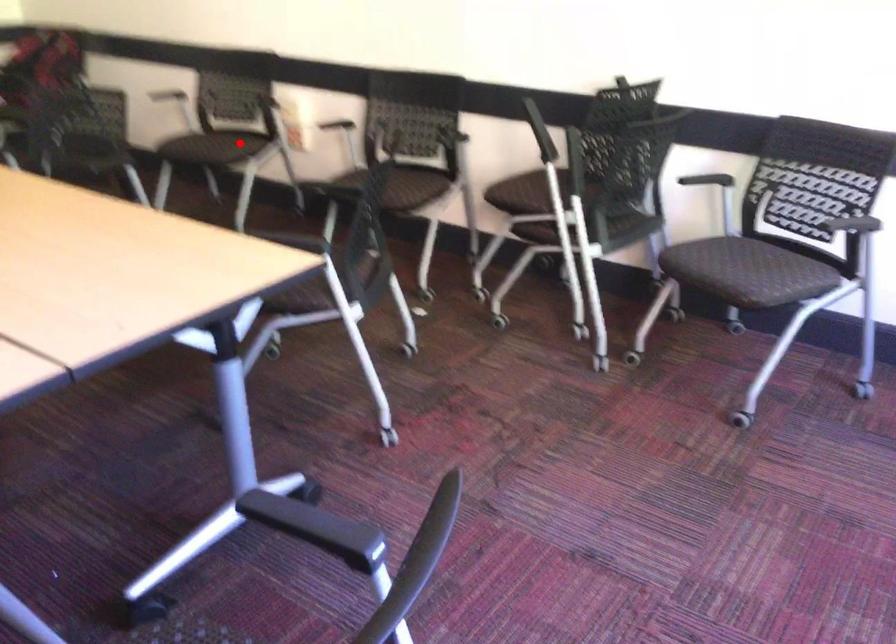
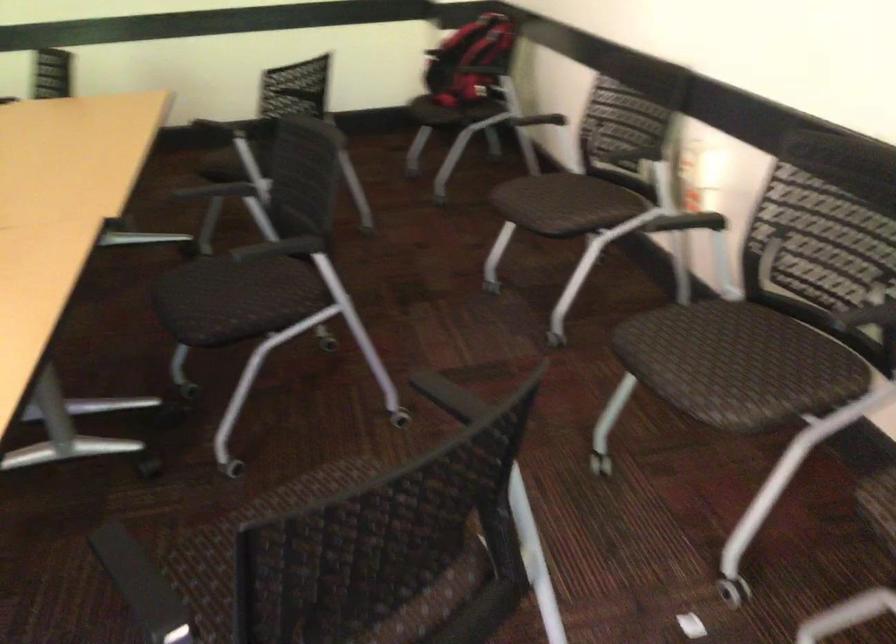
Question: I am providing you with two images of the same scene from different viewpoints. Image1 has a red point marked. In image2, the corresponding 3D location appears at what relative position? Reply with the corresponding letter.

Choices:
 (A) Closer
 (B) Farther

Answer: (A)